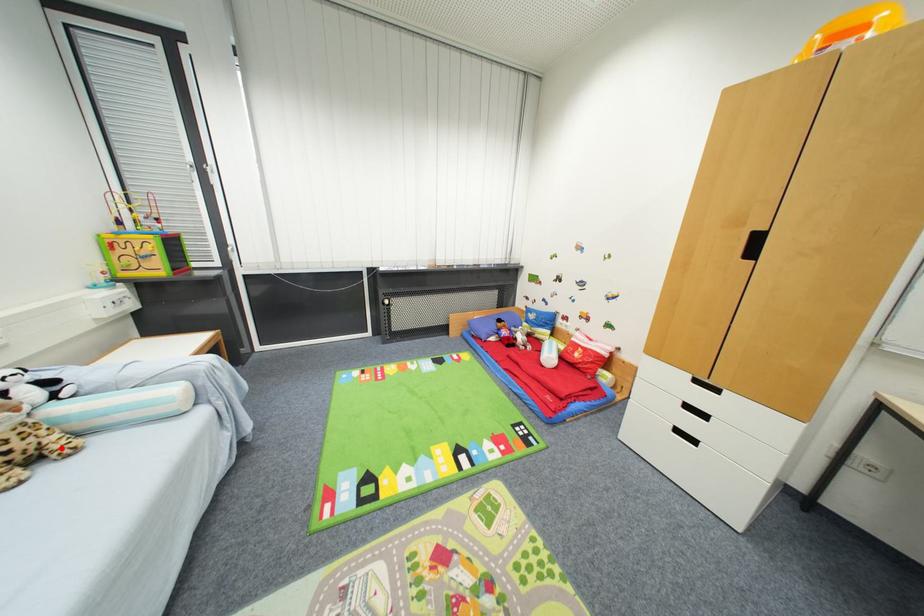
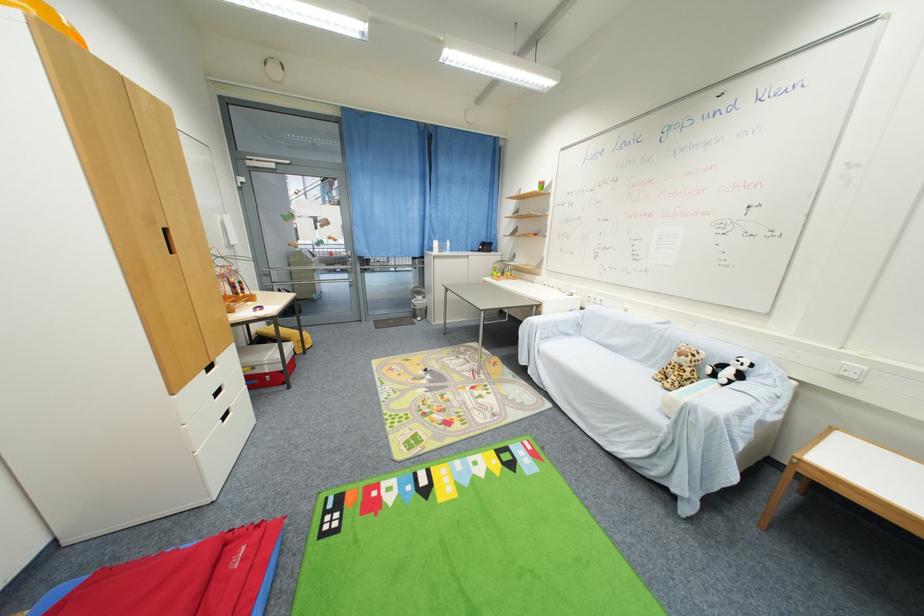
Question: I am providing you with two images of the same scene from different viewpoints. A red point is shown in image1. For the corresponding object point in image2, is it positioned nearer or farther from the camera?

Choices:
 (A) Nearer
 (B) Farther

Answer: (A)